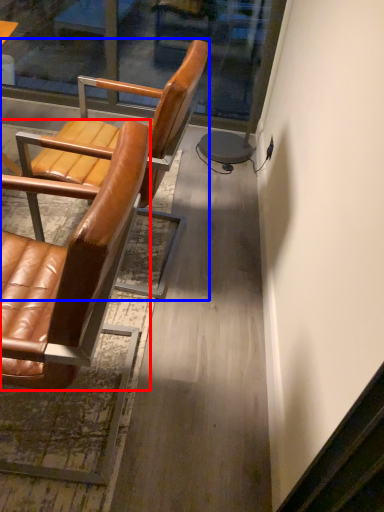
Question: Which of the following is the farthest to the observer, chair (highlighted by a red box) or chair (highlighted by a blue box)?

Choices:
 (A) chair
 (B) chair

Answer: (B)